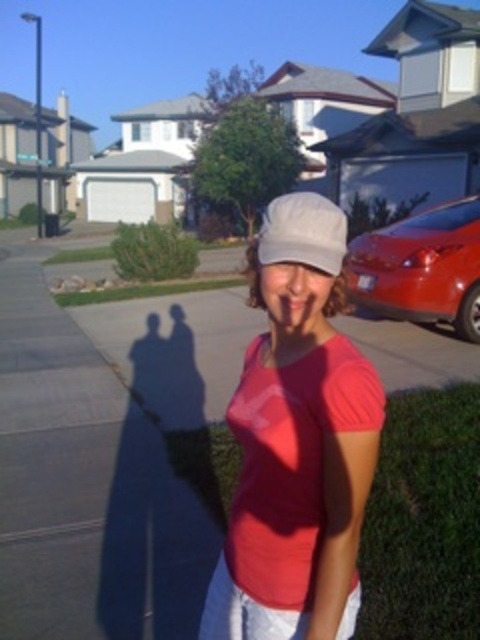
You are a delivery person who needs to place a package on the smooth concrete pavement at center and the white matte hat at center. Which surface is more to the left?

The smooth concrete pavement at center is positioned on the left side of white matte hat at center, so the smooth concrete pavement at center is more to the left.

You are a photographer trying to capture both the matte white cap at center and the shiny red car at right in a single shot. Based on their heights, which object should you focus on first to ensure both are in frame?

The matte white cap at center is shorter than the shiny red car at right, so you should focus on the shiny red car at right first to ensure both are in frame.

Looking at this image, you are a drone operator trying to deliver a package to a point on the suburban street scene. You have two delivery points marked as point 1 at coordinates point (311, 244) and point 2 at coordinates point (468, 250). Which point is closer to you so you can prioritize the delivery?

Point (311, 244) is closer to the viewer than point (468, 250), so you should prioritize delivering to point (311, 244) first.